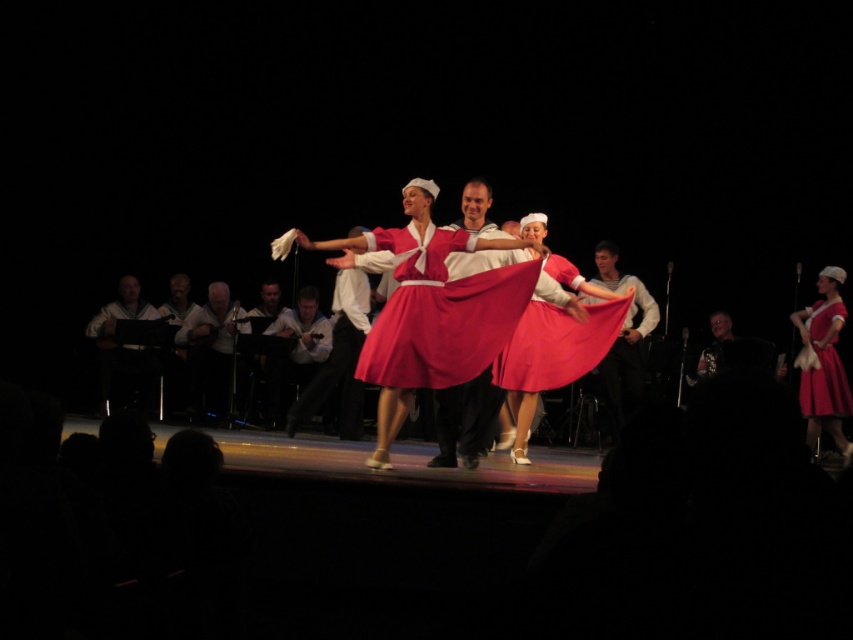
Question: Does matte red dress at right have a larger size compared to white fabric at center?

Choices:
 (A) no
 (B) yes

Answer: (A)

Question: Estimate the real-world distances between objects in this image. Which object is closer to the white fabric at center?

Choices:
 (A) smooth gray sweater at left
 (B) matte red dress at right
 (C) white leather jacket at left

Answer: (A)

Question: Does matte pink skirt at center have a lesser width compared to smooth gray sweater at left?

Choices:
 (A) yes
 (B) no

Answer: (B)

Question: Which object is positioned closest to the matte pink fabric skirt at center?

Choices:
 (A) matte red skirt at center
 (B) matte pink skirt at center
 (C) matte red dress at right
 (D) white leather jacket at left

Answer: (A)

Question: Is matte pink skirt at center to the right of white leather jacket at left from the viewer's perspective?

Choices:
 (A) yes
 (B) no

Answer: (A)

Question: Among these objects, which one is nearest to the camera?

Choices:
 (A) matte red skirt at center
 (B) matte pink skirt at center

Answer: (A)